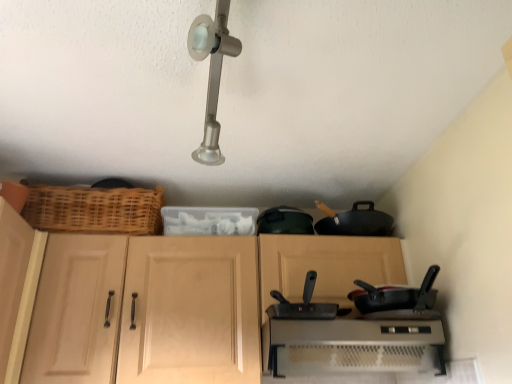
Question: Choose the correct answer: Is metallic silver toaster at lower center inside black matte wok at center or outside it?

Choices:
 (A) inside
 (B) outside

Answer: (B)

Question: From the image's perspective, relative to black matte wok at center, is metallic silver toaster at lower center above or below?

Choices:
 (A) above
 (B) below

Answer: (B)

Question: Which is nearer to the wooden cabinet at center?

Choices:
 (A) woven wood basket at left
 (B) light wood cabinet at left
 (C) black matte frying pan at right
 (D) black matte wok at center
 (E) metallic silver toaster at lower center

Answer: (E)

Question: Estimate the real-world distances between objects in this image. Which object is farther from the metallic silver toaster at lower center?

Choices:
 (A) woven wood basket at left
 (B) wooden cabinet at center
 (C) light wood cabinet at left
 (D) black matte wok at center
 (E) black matte frying pan at right

Answer: (C)